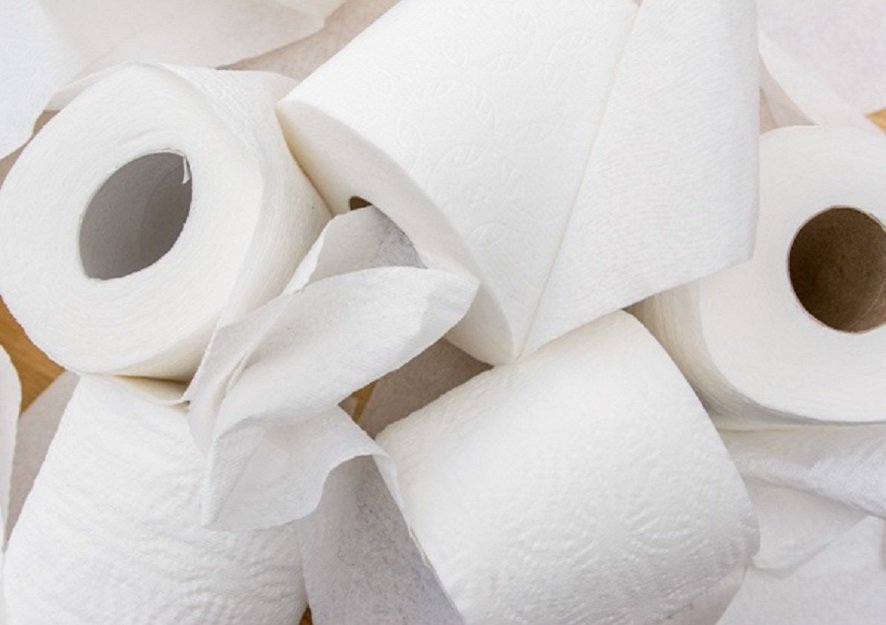
You are a GUI agent. You are given a task and a screenshot of the screen. Output one action in this format:
    pyautogui.click(x=<x>, y=<y>)
    Task: Click on the toilet paper
    The width and height of the screenshot is (886, 625).
    Given the screenshot: What is the action you would take?
    pyautogui.click(x=167, y=260), pyautogui.click(x=440, y=142), pyautogui.click(x=549, y=480), pyautogui.click(x=704, y=324), pyautogui.click(x=237, y=532)